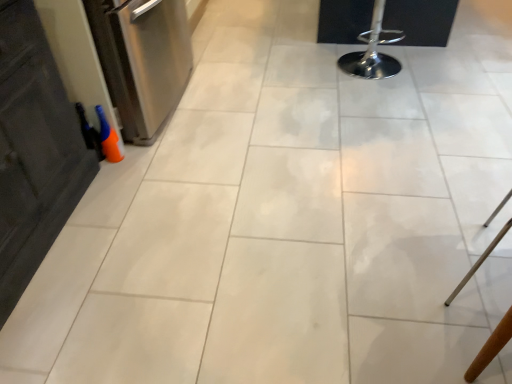
Where is `free space underneath wooden chair at lower right (from a real-world perspective)`? free space underneath wooden chair at lower right (from a real-world perspective) is located at coordinates (487, 266).